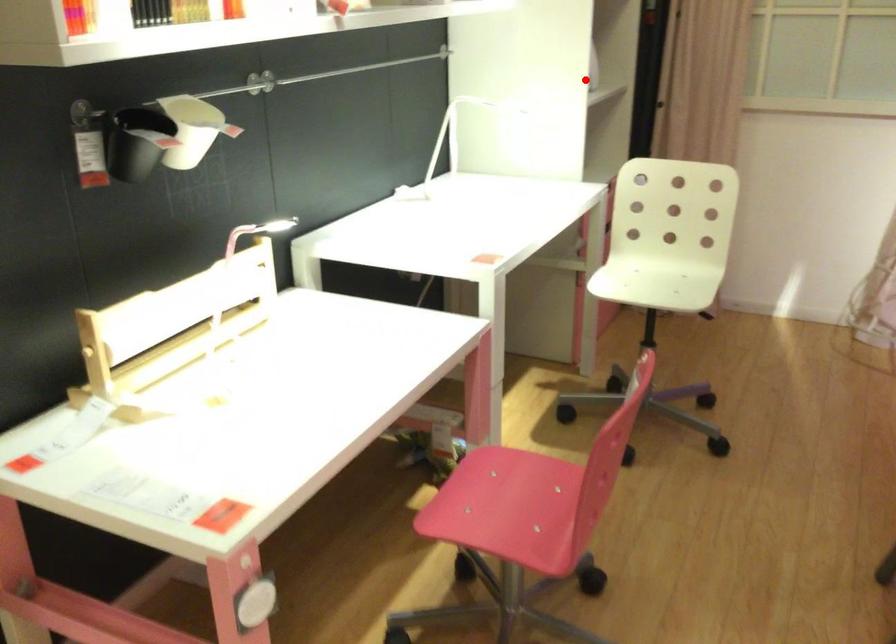
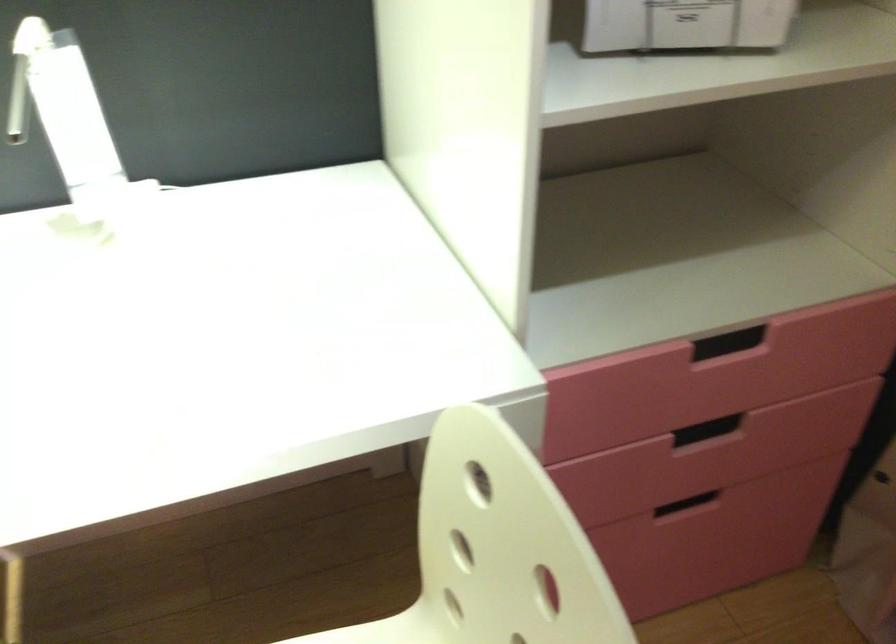
Question: I am providing you with two images of the same scene from different viewpoints. Given a red point in image1, look at the same physical point in image2. Is it:

Choices:
 (A) Closer to the viewpoint
 (B) Farther from the viewpoint

Answer: (A)